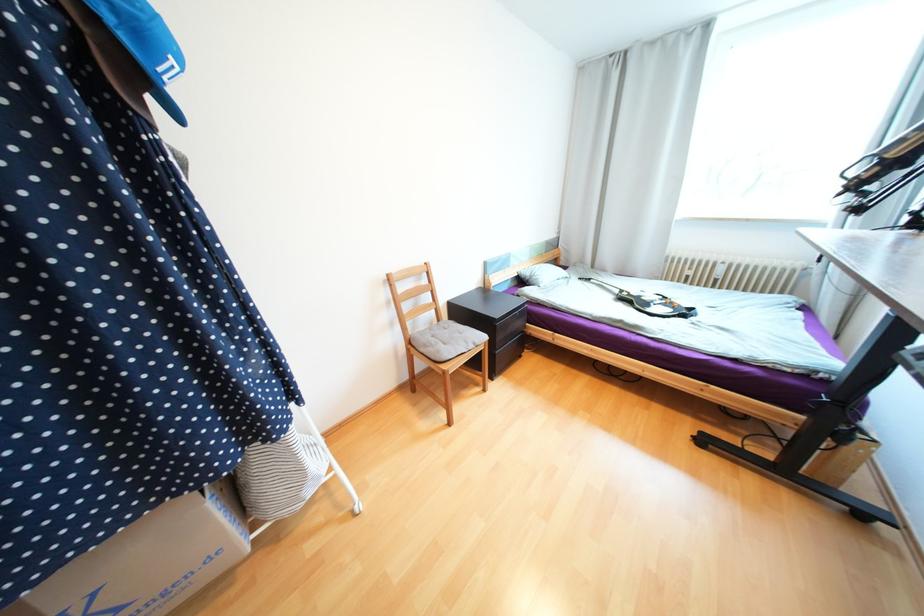
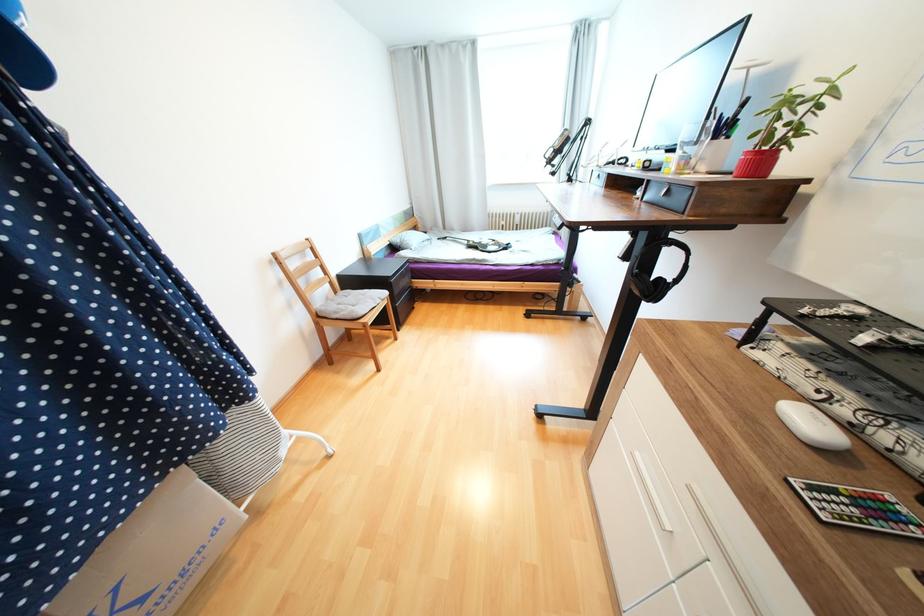
In the second image, find the point that corresponds to point 623,292 in the first image.

(471, 243)